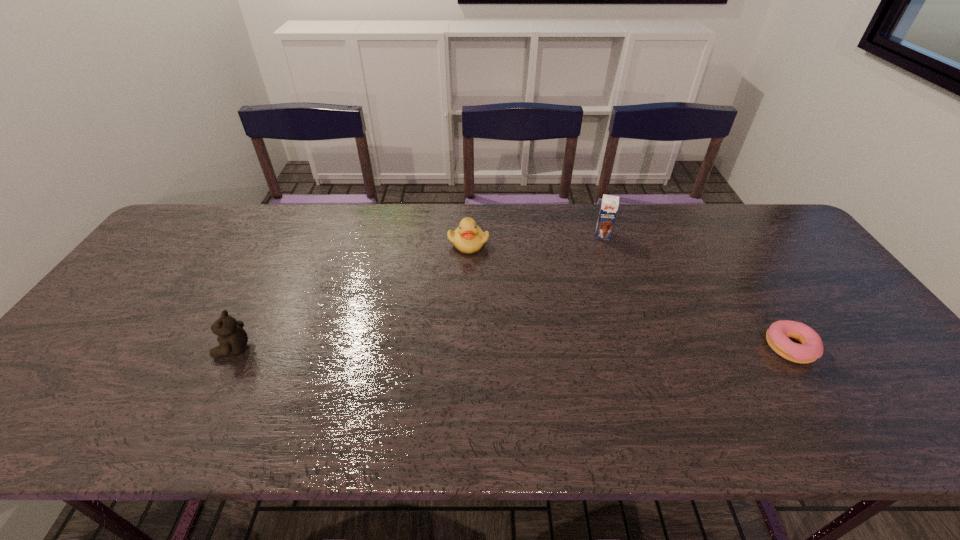
The height and width of the screenshot is (540, 960). In order to click on free space on the desktop that is between the teddy bear and the rightmost object and is positioned on the beak of the third tallest object in this screenshot , I will do `click(550, 348)`.

This screenshot has height=540, width=960. Find the location of `vacant spot on the desktop that is between the leftmost object and the shortest object and is positioned on the front label of the third object from left to right`. vacant spot on the desktop that is between the leftmost object and the shortest object and is positioned on the front label of the third object from left to right is located at coordinates (590, 348).